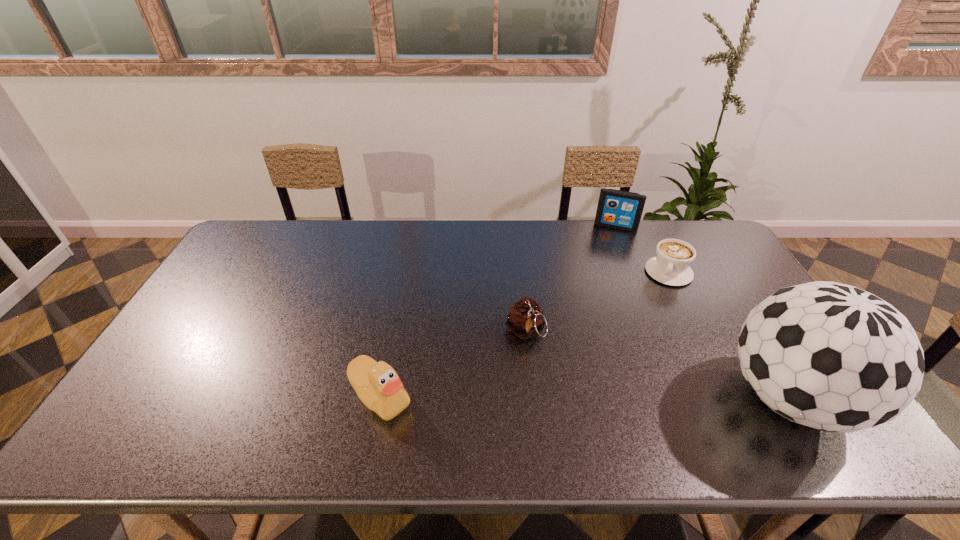
Identify the location of vacant position in the image that satisfies the following two spatial constraints: 1. at the beak of the leftmost object; 2. on the right side of the tallest object. This screenshot has height=540, width=960. (380, 398).

The height and width of the screenshot is (540, 960). Find the location of `vacant region that satisfies the following two spatial constraints: 1. on the front side of the second farthest object; 2. on the right side of the tallest object`. vacant region that satisfies the following two spatial constraints: 1. on the front side of the second farthest object; 2. on the right side of the tallest object is located at coordinates (731, 398).